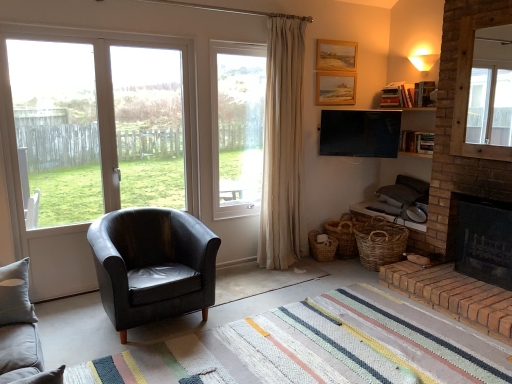
Locate an element on the screen. The image size is (512, 384). vacant space in front of woven brown basket at lower right, the second basket when ordered from right to left is located at coordinates (334, 271).